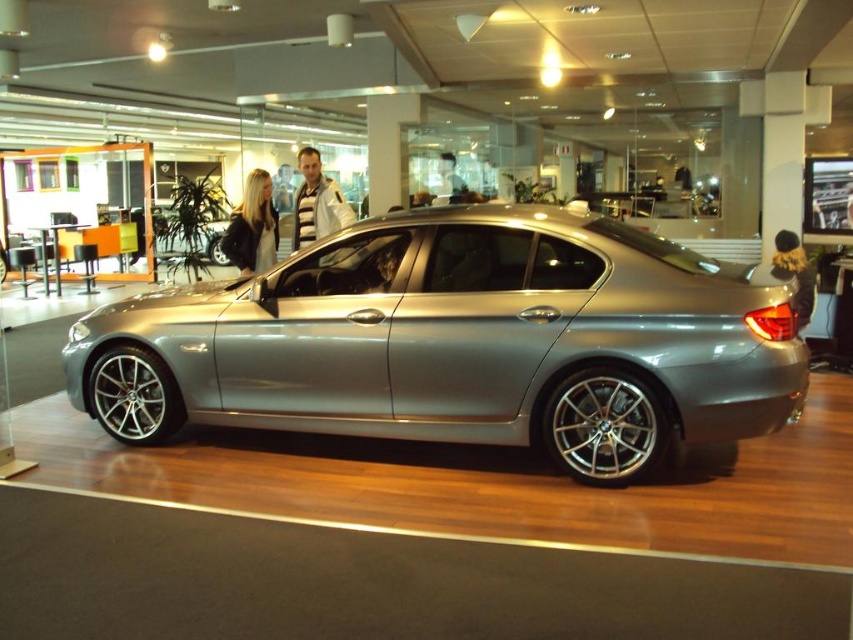
Is striped sweater at center further to the viewer compared to velvet gold jacket at center?

Yes, it is.

Which is below, striped sweater at center or velvet gold jacket at center?

velvet gold jacket at center

Is point (316, 204) behind point (802, 260)?

No, it is in front of (802, 260).

You are a GUI agent. You are given a task and a screenshot of the screen. Output one action in this format:
    pyautogui.click(x=<x>, y=<y>)
    Task: Click on the striped sweater at center
    This screenshot has width=853, height=640.
    Given the screenshot: What is the action you would take?
    pyautogui.click(x=316, y=202)

Locate an element on the screen. This screenshot has height=640, width=853. satin metallic car at center is located at coordinates (461, 342).

Between satin metallic car at center and velvet gold jacket at center, which one has more height?

With more height is satin metallic car at center.

Image resolution: width=853 pixels, height=640 pixels. I want to click on satin metallic car at center, so click(461, 342).

Who is more forward, (263,321) or (236,248)?

Point (263,321) is more forward.

In the scene shown: Is the position of satin metallic car at center more distant than that of dark brown leather jacket at center?

No.

Describe the element at coordinates (461, 342) in the screenshot. I see `satin metallic car at center` at that location.

Where is `satin metallic car at center`? satin metallic car at center is located at coordinates (461, 342).